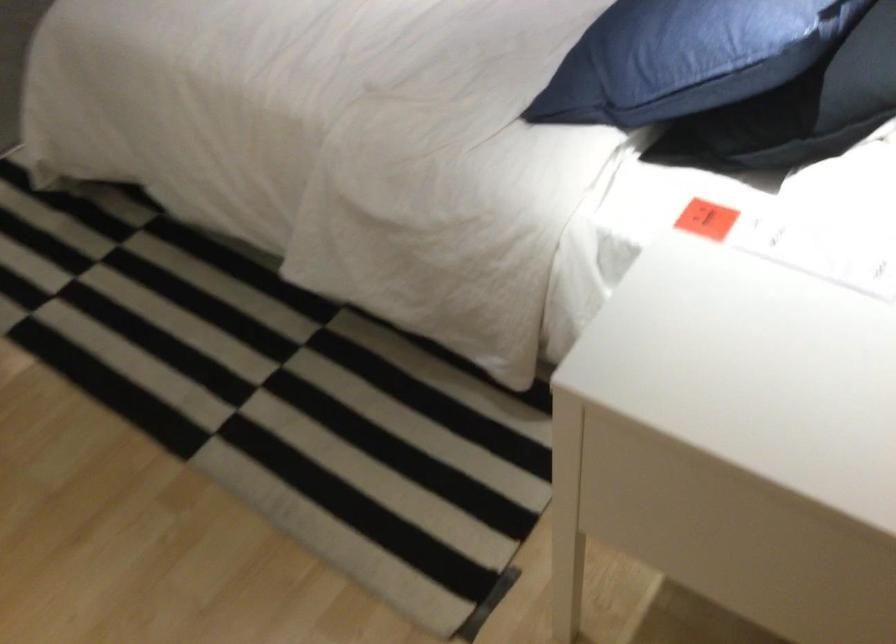
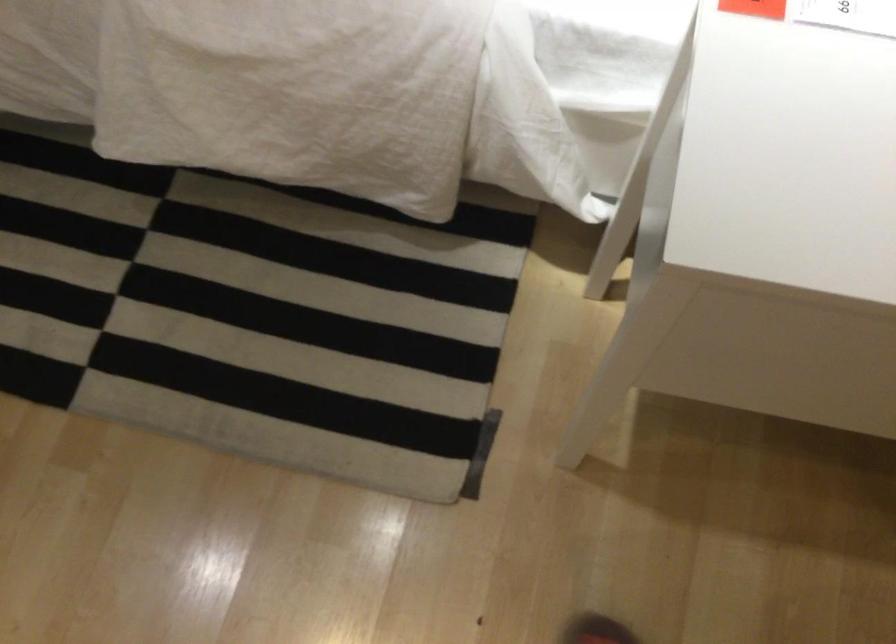
Find the pixel in the second image that matches (x=705, y=232) in the first image.

(754, 8)